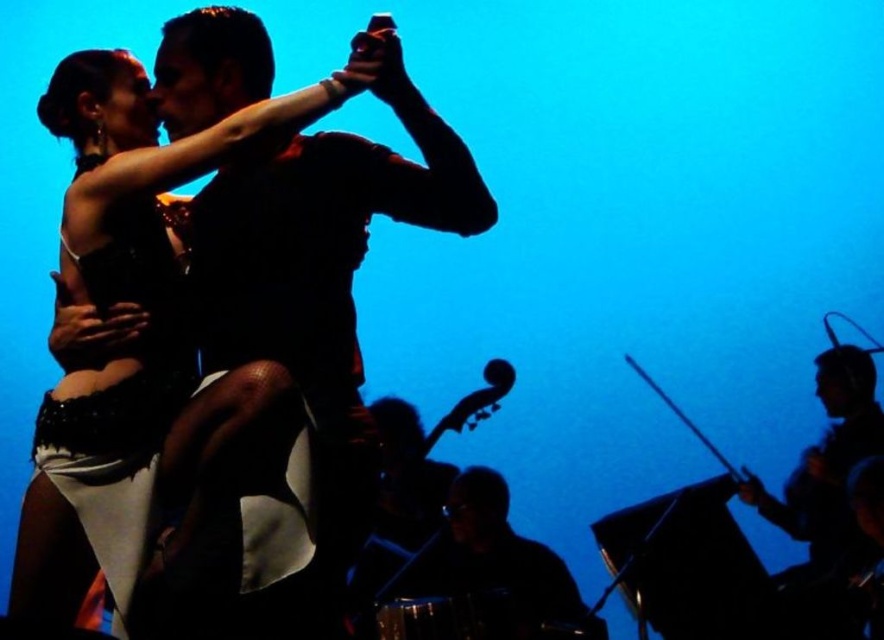
You are a photographer at the back of the stage. You want to take a photo of both the shiny black dress at center and the silvery metallic drum at lower right. Based on their positions, which object should you focus on first to ensure both are in frame?

The shiny black dress at center is positioned on the left side of the silvery metallic drum at lower right, so you should focus on the silvery metallic drum at lower right first to ensure both are in frame.

You are a photographer at a dance performance. You have a camera and want to take a closeup of the shiny black dress at center. Based on the scene description, can you determine if you are close enough to capture the dress clearly?

The shiny black dress at center and camera are 8.08 feet apart. Since 8.08 feet is a reasonable distance for capturing a clear closeup, yes, you can take a clear photo of the shiny black dress at center.

You are a photographer at a fashion show. You have two items in your frame, the shiny black dress at center and the silvery metallic drum at lower right. Which item should you focus on if you want to capture the smaller object?

The shiny black dress at center has a smaller size compared to the silvery metallic drum at lower right, so you should focus on the shiny black dress at center to capture the smaller object.